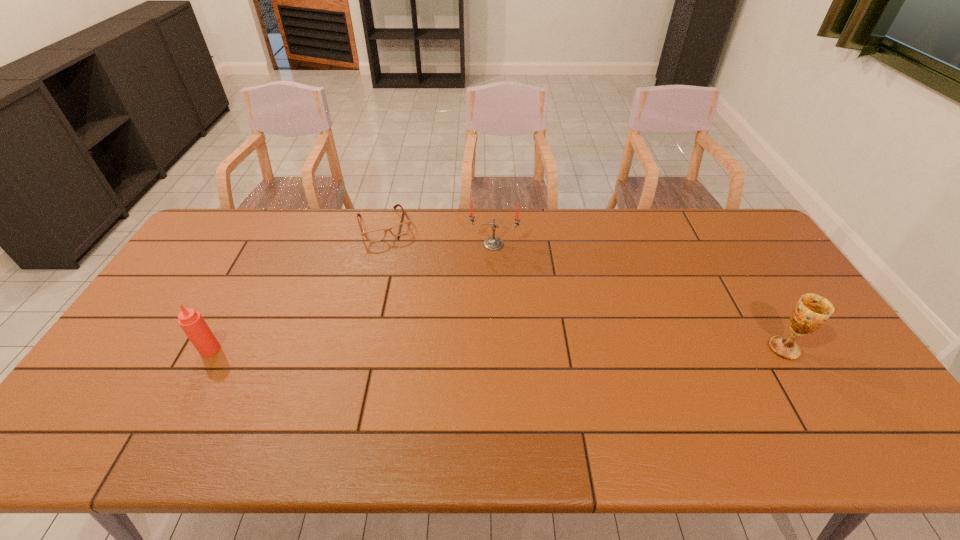
At what (x,y) coordinates should I click in order to perform the action: click on free region at the far right corner of the desktop. Please return your answer as a coordinate pair (x, y). The image size is (960, 540). Looking at the image, I should click on (722, 226).

At what (x,y) coordinates should I click in order to perform the action: click on free space between the shortest object and the Tabasco sauce. Please return your answer as a coordinate pair (x, y). Image resolution: width=960 pixels, height=540 pixels. Looking at the image, I should click on (298, 287).

Where is `blank region between the chalice and the third object from left to right`? The height and width of the screenshot is (540, 960). blank region between the chalice and the third object from left to right is located at coordinates (638, 296).

Identify the location of vacant area that lies between the chalice and the second object from left to right. The image size is (960, 540). (585, 287).

Identify the location of empty space between the third object from left to right and the rightmost object. The width and height of the screenshot is (960, 540). (638, 296).

This screenshot has height=540, width=960. In order to click on free space between the Tabasco sauce and the second object from right to left in this screenshot , I will do `click(351, 296)`.

Locate an element on the screen. empty space between the Tabasco sauce and the second object from right to left is located at coordinates (351, 296).

Where is `vacant area between the candle and the leftmost object`? This screenshot has height=540, width=960. vacant area between the candle and the leftmost object is located at coordinates (351, 296).

Find the location of a particular element. blank region between the rightmost object and the shortest object is located at coordinates (585, 287).

This screenshot has height=540, width=960. I want to click on vacant point located between the second object from right to left and the second object from left to right, so click(x=440, y=235).